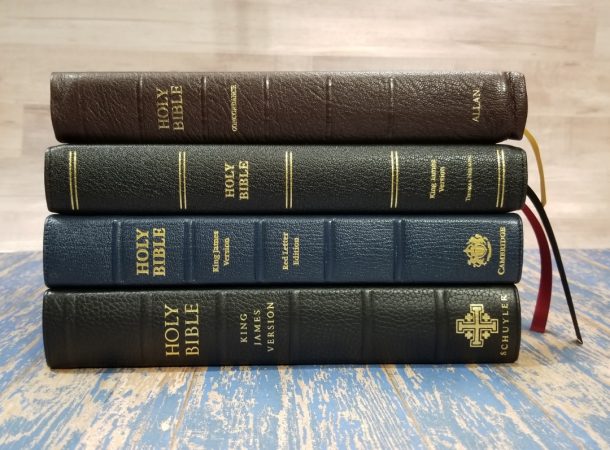
Locate an element on the screen. Image resolution: width=610 pixels, height=450 pixels. brown book is located at coordinates pyautogui.click(x=298, y=99).